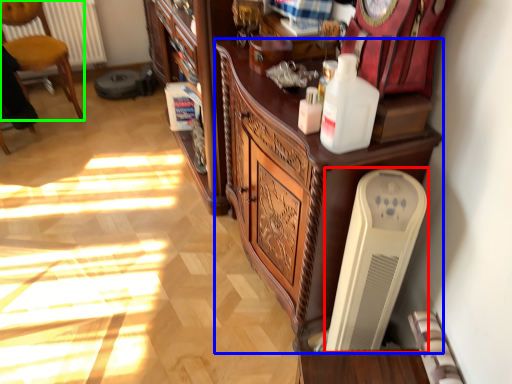
Question: Estimate the real-world distances between objects in this image. Which object is closer to appliance (highlighted by a red box), cabinetry (highlighted by a blue box) or chair (highlighted by a green box)?

Choices:
 (A) cabinetry
 (B) chair

Answer: (A)